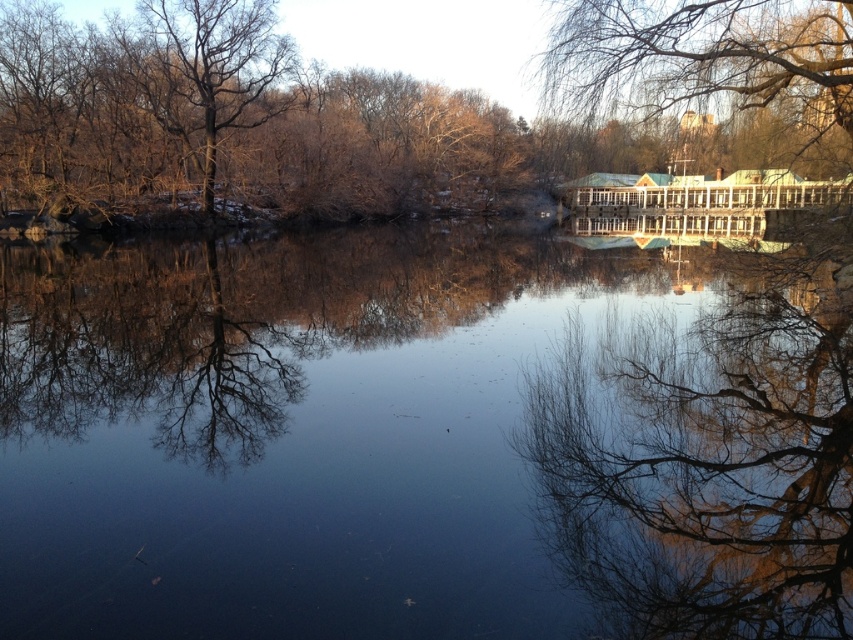
Question: Among these objects, which one is nearest to the camera?

Choices:
 (A) bare branches at upper left
 (B) transparent glass river at center
 (C) green leafy tree at upper right

Answer: (B)

Question: Can you confirm if transparent glass river at center is thinner than brown leafless tree at upper center?

Choices:
 (A) yes
 (B) no

Answer: (A)

Question: Which of these objects is positioned closest to the bare branches at upper left?

Choices:
 (A) green leafy tree at upper right
 (B) brown leafless tree at upper center

Answer: (B)

Question: Among these points, which one is farthest from the camera?

Choices:
 (A) pyautogui.click(x=265, y=61)
 (B) pyautogui.click(x=91, y=93)
 (C) pyautogui.click(x=625, y=106)
 (D) pyautogui.click(x=408, y=305)

Answer: (A)

Question: Where is transparent glass river at center located in relation to green leafy tree at upper right in the image?

Choices:
 (A) right
 (B) left

Answer: (B)

Question: Where is transparent glass river at center located in relation to brown leafless tree at upper center in the image?

Choices:
 (A) left
 (B) right

Answer: (B)